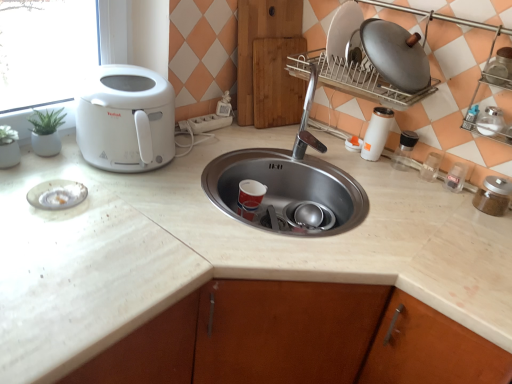
Measure the distance between white plastic soap dispenser at upper right, the first appliance positioned from the left, and camera.

They are 4.93 feet apart.

What do you see at coordinates (353, 144) in the screenshot?
I see `white plastic soap dispenser at upper right, the 8th appliance viewed from the right` at bounding box center [353, 144].

Where is `white plastic toaster at left`? This screenshot has width=512, height=384. white plastic toaster at left is located at coordinates (126, 119).

Identify the location of transparent plastic container at right, the fourth appliance in the left-to-right sequence. The width and height of the screenshot is (512, 384). (431, 167).

Choose the correct answer: Is brown glass jar at right, the 8th appliance positioned from the left, inside white plastic toaster at left or outside it?

brown glass jar at right, the 8th appliance positioned from the left, cannot be found inside white plastic toaster at left.

Is brown glass jar at right, the 8th appliance positioned from the left, not near white plastic toaster at left?

Yes.

How distant is brown glass jar at right, the 8th appliance positioned from the left, from white plastic toaster at left?

They are 1.07 meters apart.

From a real-world perspective, which is physically below, brown glass jar at right, the 8th appliance positioned from the left, or white plastic toaster at left?

In real-world perspective, brown glass jar at right, the 8th appliance positioned from the left, is lower.

Considering the relative sizes of transparent plastic container at right, the fourth appliance in the left-to-right sequence, and metallic silver pot at upper right, which is counted as the sixth appliance, starting from the left, in the image provided, is transparent plastic container at right, the fourth appliance in the left-to-right sequence, bigger than metallic silver pot at upper right, which is counted as the sixth appliance, starting from the left,?

Incorrect, transparent plastic container at right, the fourth appliance in the left-to-right sequence, is not larger than metallic silver pot at upper right, which is counted as the sixth appliance, starting from the left.

From a real-world perspective, is transparent plastic container at right, which is counted as the 5th appliance, starting from the right, on top of metallic silver pot at upper right, which appears as the 3th appliance when viewed from the right?

Actually, transparent plastic container at right, which is counted as the 5th appliance, starting from the right, is physically below metallic silver pot at upper right, which appears as the 3th appliance when viewed from the right, in the real world.

Would you say transparent plastic container at right, the fourth appliance in the left-to-right sequence, is outside metallic silver pot at upper right, which appears as the 3th appliance when viewed from the right?

Yes, transparent plastic container at right, the fourth appliance in the left-to-right sequence, is outside of metallic silver pot at upper right, which appears as the 3th appliance when viewed from the right.

In the scene shown: Considering the sizes of objects transparent plastic container at right, the fourth appliance in the left-to-right sequence, and metallic silver pot at upper right, which appears as the 3th appliance when viewed from the right, in the image provided, who is wider, transparent plastic container at right, the fourth appliance in the left-to-right sequence, or metallic silver pot at upper right, which appears as the 3th appliance when viewed from the right,?

metallic silver pot at upper right, which appears as the 3th appliance when viewed from the right, is wider.

Is wooden cutting board at center to the right of white marble countertop at center from the viewer's perspective?

Correct, you'll find wooden cutting board at center to the right of white marble countertop at center.

Does point (279, 16) come closer to viewer compared to point (250, 266)?

That is False.

From a real-world perspective, is wooden cutting board at center positioned above or below white marble countertop at center?

wooden cutting board at center is above white marble countertop at center.

From the image's perspective, is wooden cutting board at center over white marble countertop at center?

Indeed, from the image's perspective, wooden cutting board at center is shown above white marble countertop at center.

Does point (489, 73) come farther from viewer compared to point (414, 138)?

No, it is in front of (414, 138).

Is metallic silver pot at upper right, which appears as the 3th appliance when viewed from the right, facing away from clear glass bottle at right, which ranks as the third appliance in left-to-right order?

metallic silver pot at upper right, which appears as the 3th appliance when viewed from the right, is not turned away from clear glass bottle at right, which ranks as the third appliance in left-to-right order.

Which of these two, metallic silver pot at upper right, which is counted as the sixth appliance, starting from the left, or clear glass bottle at right, the sixth appliance when ordered from right to left, stands taller?

Standing taller between the two is clear glass bottle at right, the sixth appliance when ordered from right to left.

Which is in front, metallic silver pot at upper right, which appears as the 3th appliance when viewed from the right, or clear glass bottle at right, which ranks as the third appliance in left-to-right order?

metallic silver pot at upper right, which appears as the 3th appliance when viewed from the right, is in front.

From the image's perspective, is metallic silver pot at upper right, which appears as the 3th appliance when viewed from the right, under brown glass jar at right, acting as the first appliance starting from the right?

Incorrect, from the image's perspective, metallic silver pot at upper right, which appears as the 3th appliance when viewed from the right, is higher than brown glass jar at right, acting as the first appliance starting from the right.

Based on the photo, which is more to the left, metallic silver pot at upper right, which is counted as the sixth appliance, starting from the left, or brown glass jar at right, the 8th appliance positioned from the left?

From the viewer's perspective, metallic silver pot at upper right, which is counted as the sixth appliance, starting from the left, appears more on the left side.

What's the angular difference between metallic silver pot at upper right, which is counted as the sixth appliance, starting from the left, and brown glass jar at right, the 8th appliance positioned from the left,'s facing directions?

There is a 4.34-degree angle between the facing directions of metallic silver pot at upper right, which is counted as the sixth appliance, starting from the left, and brown glass jar at right, the 8th appliance positioned from the left.

Is brown glass jar at right, acting as the first appliance starting from the right, not within white marble countertop at center?

Indeed, brown glass jar at right, acting as the first appliance starting from the right, is completely outside white marble countertop at center.

Considering the relative sizes of brown glass jar at right, the 8th appliance positioned from the left, and white marble countertop at center in the image provided, is brown glass jar at right, the 8th appliance positioned from the left, taller than white marble countertop at center?

No.

Can you confirm if brown glass jar at right, the 8th appliance positioned from the left, is thinner than white marble countertop at center?

Correct, the width of brown glass jar at right, the 8th appliance positioned from the left, is less than that of white marble countertop at center.

Considering the relative sizes of metallic silver pot at upper right, which appears as the 3th appliance when viewed from the right, and satin silver jar at right, which is the seventh appliance in left-to-right order, in the image provided, is metallic silver pot at upper right, which appears as the 3th appliance when viewed from the right, thinner than satin silver jar at right, which is the seventh appliance in left-to-right order,?

Yes, metallic silver pot at upper right, which appears as the 3th appliance when viewed from the right, is thinner than satin silver jar at right, which is the seventh appliance in left-to-right order.

What's the angular difference between metallic silver pot at upper right, which appears as the 3th appliance when viewed from the right, and satin silver jar at right, the second appliance when ordered from right to left,'s facing directions?

There is a 0.000934-degree angle between the facing directions of metallic silver pot at upper right, which appears as the 3th appliance when viewed from the right, and satin silver jar at right, the second appliance when ordered from right to left.

In the image, is metallic silver pot at upper right, which is counted as the sixth appliance, starting from the left, positioned in front of or behind satin silver jar at right, which is the seventh appliance in left-to-right order?

metallic silver pot at upper right, which is counted as the sixth appliance, starting from the left, is in front of satin silver jar at right, which is the seventh appliance in left-to-right order.

Consider the image. Who is shorter, metallic silver pot at upper right, which appears as the 3th appliance when viewed from the right, or satin silver jar at right, the second appliance when ordered from right to left?

satin silver jar at right, the second appliance when ordered from right to left, is shorter.

Identify the location of home appliance in front of the brown glass jar at right, the 8th appliance positioned from the left. The height and width of the screenshot is (384, 512). (126, 119).

What are the coordinates of `the 5th appliance located above the transparent plastic container at right, which is counted as the 5th appliance, starting from the right (from a real-world perspective)` in the screenshot? It's located at (500, 67).

Looking at the image, which one is located closer to transparent plastic container at right, the fourth appliance in the left-to-right sequence, brown glass jar at right, acting as the first appliance starting from the right, or clear glass bottle at right, the sixth appliance when ordered from right to left?

clear glass bottle at right, the sixth appliance when ordered from right to left.

In the scene shown: Looking at the image, which one is located further to metallic silver pot at upper right, which is counted as the sixth appliance, starting from the left, brown glass jar at right, acting as the first appliance starting from the right, or clear glass bottle at right, the sixth appliance when ordered from right to left?

Based on the image, clear glass bottle at right, the sixth appliance when ordered from right to left, appears to be further to metallic silver pot at upper right, which is counted as the sixth appliance, starting from the left.

From the image, which object appears to be nearer to brown glass jar at right, the 8th appliance positioned from the left, clear glass bottle at right, which ranks as the third appliance in left-to-right order, or white plastic soap dispenser at upper right, the first appliance positioned from the left?

Based on the image, clear glass bottle at right, which ranks as the third appliance in left-to-right order, appears to be nearer to brown glass jar at right, the 8th appliance positioned from the left.

Considering their positions, is brown glass jar at right, the 8th appliance positioned from the left, positioned closer to clear plastic container at right, arranged as the fifth appliance when viewed from the left, than white plastic toaster at left?

Among the two, brown glass jar at right, the 8th appliance positioned from the left, is located nearer to clear plastic container at right, arranged as the fifth appliance when viewed from the left.

Considering their positions, is satin silver jar at right, which is the seventh appliance in left-to-right order, positioned closer to white plastic toaster at left than clear glass bottle at right, which ranks as the third appliance in left-to-right order?

clear glass bottle at right, which ranks as the third appliance in left-to-right order, is closer to white plastic toaster at left.

Estimate the real-world distances between objects in this image. Which object is further from clear glass bottle at right, which ranks as the third appliance in left-to-right order, white glossy thermos at right, the seventh appliance positioned from the right, or metallic silver pot at upper right, which appears as the 3th appliance when viewed from the right?

metallic silver pot at upper right, which appears as the 3th appliance when viewed from the right, lies further to clear glass bottle at right, which ranks as the third appliance in left-to-right order, than the other object.

In the scene shown: From the image, which object appears to be nearer to wooden cutting board at center, clear glass bottle at right, which ranks as the third appliance in left-to-right order, or white plastic soap dispenser at upper right, the 8th appliance viewed from the right?

white plastic soap dispenser at upper right, the 8th appliance viewed from the right.

When comparing their distances from white marble countertop at center, does transparent plastic container at right, the fourth appliance in the left-to-right sequence, or clear plastic container at right, arranged as the fifth appliance when viewed from the left, seem closer?

Based on the image, transparent plastic container at right, the fourth appliance in the left-to-right sequence, appears to be nearer to white marble countertop at center.

Where is `countertop situated between white plastic toaster at left and clear glass bottle at right, which ranks as the third appliance in left-to-right order, from left to right`? countertop situated between white plastic toaster at left and clear glass bottle at right, which ranks as the third appliance in left-to-right order, from left to right is located at coordinates (222, 251).

The width and height of the screenshot is (512, 384). What are the coordinates of `appliance between white plastic toaster at left and white glossy thermos at right, the seventh appliance positioned from the right, in the horizontal direction` in the screenshot? It's located at pyautogui.click(x=353, y=144).

Where is `cabinetry between white plastic toaster at left and metallic silver pot at upper right, which appears as the 3th appliance when viewed from the right`? cabinetry between white plastic toaster at left and metallic silver pot at upper right, which appears as the 3th appliance when viewed from the right is located at coordinates (269, 62).

The image size is (512, 384). Find the location of `countertop between white plastic toaster at left and metallic silver pot at upper right, which appears as the 3th appliance when viewed from the right`. countertop between white plastic toaster at left and metallic silver pot at upper right, which appears as the 3th appliance when viewed from the right is located at coordinates (222, 251).